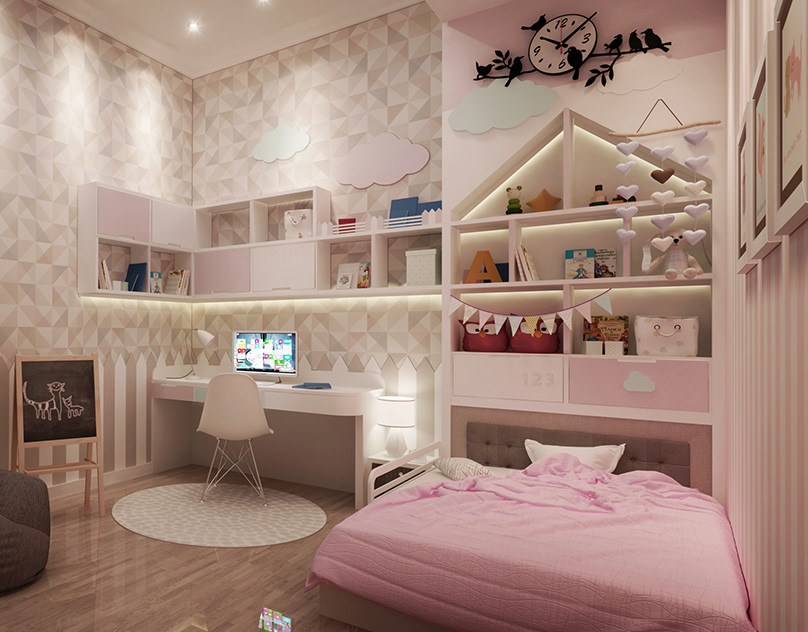
Locate an element on the screen. decorative bird is located at coordinates (478, 75), (516, 66), (532, 25), (575, 64), (615, 45), (634, 45), (655, 39).